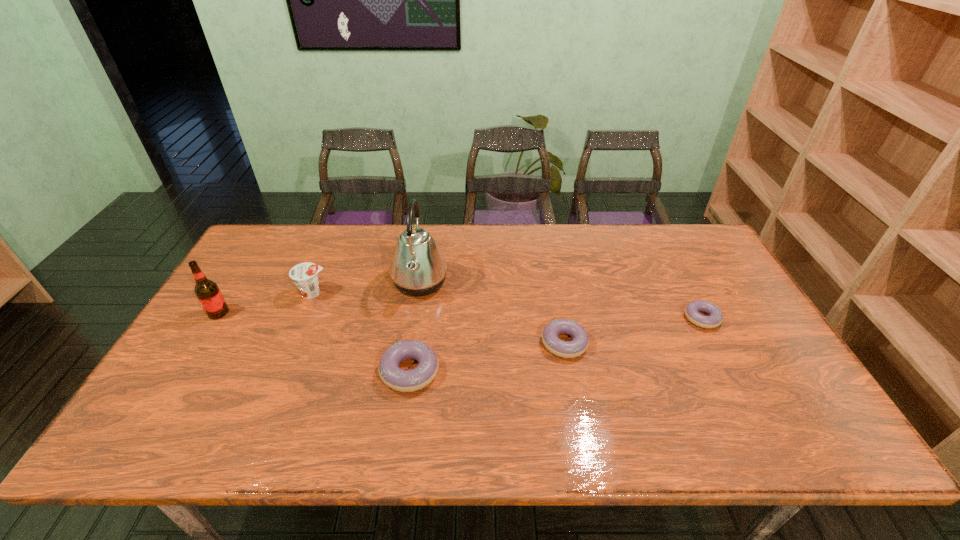
In order to click on the second object from left to right in this screenshot , I will do `click(304, 275)`.

I want to click on free location located on the back of the tallest doughnut, so click(x=426, y=259).

The width and height of the screenshot is (960, 540). What are the coordinates of `vacant space located on the back of the second tallest doughnut` in the screenshot? It's located at (547, 251).

Where is `free region located on the back of the rightmost object`? This screenshot has width=960, height=540. free region located on the back of the rightmost object is located at coordinates (679, 274).

I want to click on blank space located 0.070m from the spout of the kettle, so click(470, 282).

Where is `free spot located on the front of the root beer`? The height and width of the screenshot is (540, 960). free spot located on the front of the root beer is located at coordinates (188, 362).

Identify the location of vacant space located 0.320m on the right of the yogurt. The image size is (960, 540). (x=435, y=293).

You are a GUI agent. You are given a task and a screenshot of the screen. Output one action in this format:
    pyautogui.click(x=<x>, y=<y>)
    Task: Click on the object located in the far edge section of the desktop
    The width and height of the screenshot is (960, 540).
    Given the screenshot: What is the action you would take?
    pyautogui.click(x=418, y=268)

Where is `object located at the near edge`? This screenshot has height=540, width=960. object located at the near edge is located at coordinates (394, 377).

The height and width of the screenshot is (540, 960). I want to click on object that is positioned at the left edge, so click(x=208, y=293).